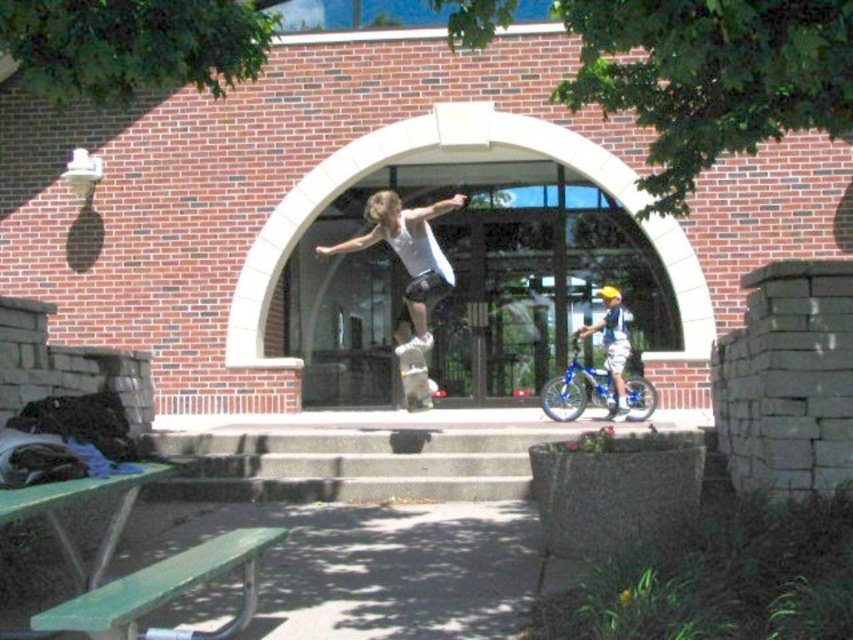
Question: Is green painted wood picnic table at lower left thinner than blue metallic bicycle at center?

Choices:
 (A) yes
 (B) no

Answer: (A)

Question: Among these points, which one is nearest to the camera?

Choices:
 (A) (134, 579)
 (B) (631, 404)
 (C) (421, 374)
 (D) (442, 205)

Answer: (A)

Question: Which point is farther to the camera?

Choices:
 (A) (260, 540)
 (B) (347, 248)
 (C) (608, 349)
 (D) (418, 392)

Answer: (C)

Question: In this image, where is green painted wood picnic table at lower left located relative to white matte skateboard at center?

Choices:
 (A) left
 (B) right

Answer: (A)

Question: Which point is closer to the camera?

Choices:
 (A) blue metallic bicycle at right
 (B) white matte skateboard at center
 (C) green painted wood picnic table at lower left

Answer: (C)

Question: Can you confirm if blue metallic bicycle at center is wider than wooden skateboard at center?

Choices:
 (A) yes
 (B) no

Answer: (A)